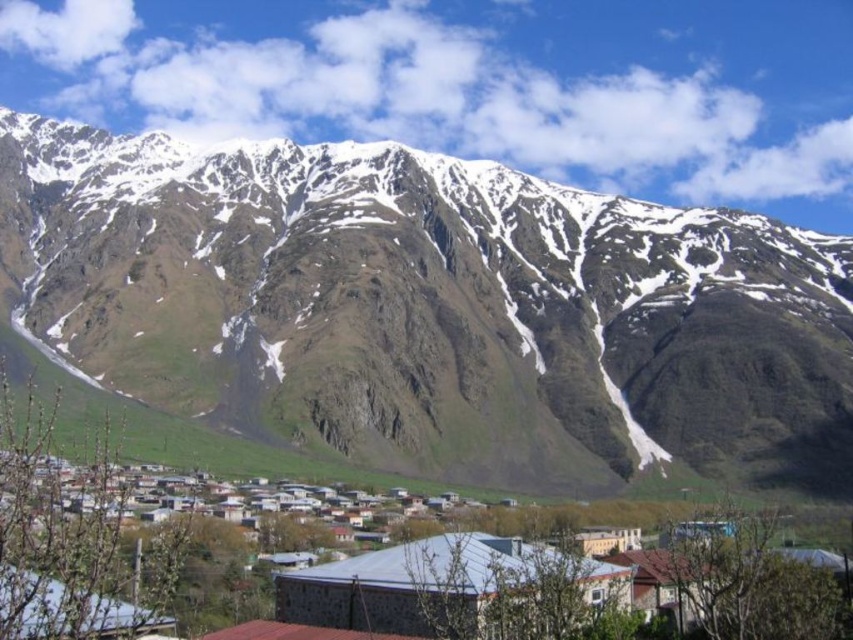
From the picture: Is snowy rock mountain at upper center smaller than stone houses at center?

No.

Does point (741, 234) come in front of point (834, 602)?

No, (741, 234) is further to viewer.

Locate an element on the screen. The height and width of the screenshot is (640, 853). snowy rock mountain at upper center is located at coordinates (430, 308).